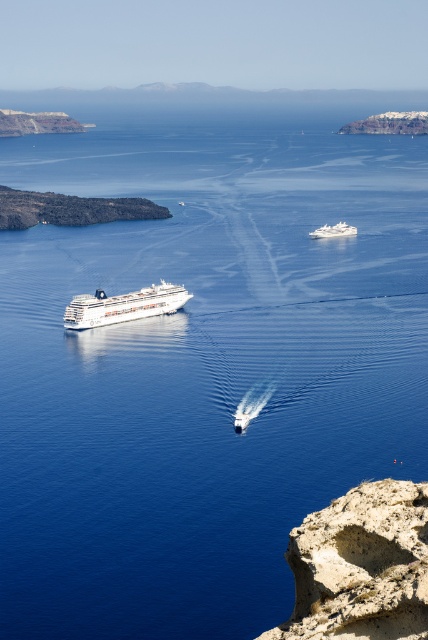
Is white glossy cruise ship at center below white glossy yacht at upper center?

Yes.

Find the location of a particular element. The width and height of the screenshot is (428, 640). white glossy cruise ship at center is located at coordinates (124, 305).